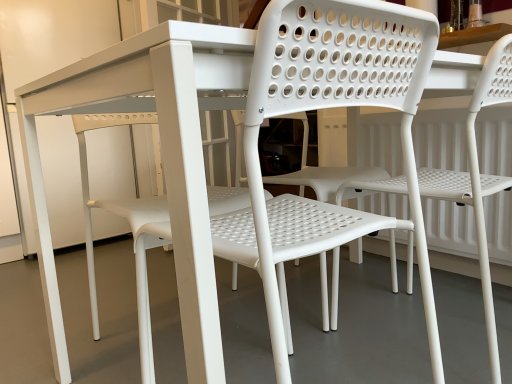
Identify the location of blank space to the left of white plastic chair at center, the 1th chair positioned from the right. (309, 337).